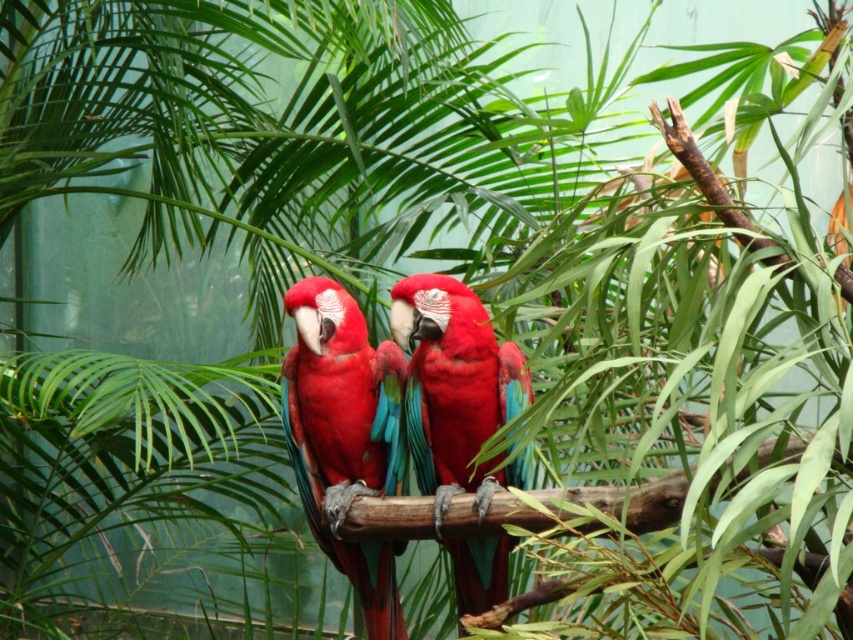
Question: Is matte red parrot at center thinner than glossy red parrot at center?

Choices:
 (A) yes
 (B) no

Answer: (A)

Question: Does matte red parrot at center appear on the right side of glossy red parrot at center?

Choices:
 (A) yes
 (B) no

Answer: (B)

Question: Among these objects, which one is farthest from the camera?

Choices:
 (A) glossy red parrot at center
 (B) matte red parrot at center

Answer: (B)

Question: Which point appears farthest from the camera in this image?

Choices:
 (A) (490, 600)
 (B) (285, 387)

Answer: (B)

Question: Can you confirm if matte red parrot at center is wider than glossy red parrot at center?

Choices:
 (A) yes
 (B) no

Answer: (B)